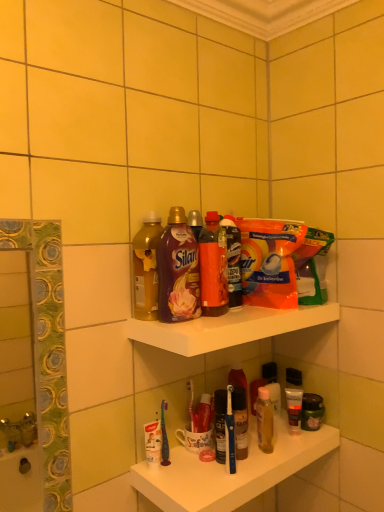
Identify the location of vacant space to the right of matte plastic bottle at upper center, marked as the second bottle in a left-to-right arrangement. The width and height of the screenshot is (384, 512). (230, 317).